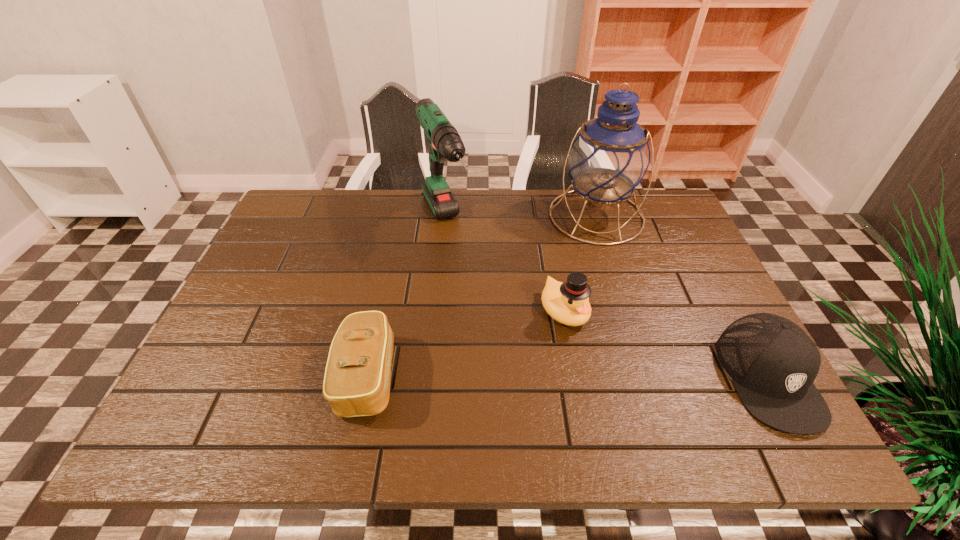
Identify the location of vacant region located on the handle side of the drill. The image size is (960, 540). (506, 368).

Find the location of a particular element. The height and width of the screenshot is (540, 960). blank area located on the handle side of the drill is located at coordinates click(x=508, y=372).

Find the location of `vacant space situated 0.250m on the front-facing side of the lantern`. vacant space situated 0.250m on the front-facing side of the lantern is located at coordinates (594, 312).

At what (x,y) coordinates should I click in order to perform the action: click on vacant space situated on the front-facing side of the lantern. Please return your answer as a coordinate pair (x, y). The height and width of the screenshot is (540, 960). Looking at the image, I should click on (594, 334).

Locate an element on the screen. This screenshot has height=540, width=960. free spot located 0.390m on the front-facing side of the lantern is located at coordinates (594, 359).

Identify the location of drill that is at the far edge. (444, 141).

At what (x,y) coordinates should I click in order to perform the action: click on lantern that is at the far edge. Please return your answer as a coordinate pair (x, y). This screenshot has width=960, height=540. Looking at the image, I should click on point(610,157).

Where is `clutch bag that is at the near edge`? clutch bag that is at the near edge is located at coordinates (357, 378).

Where is `cap at the near edge`? cap at the near edge is located at coordinates (773, 363).

The height and width of the screenshot is (540, 960). What are the coordinates of `cap positioned at the right edge` in the screenshot? It's located at (773, 363).